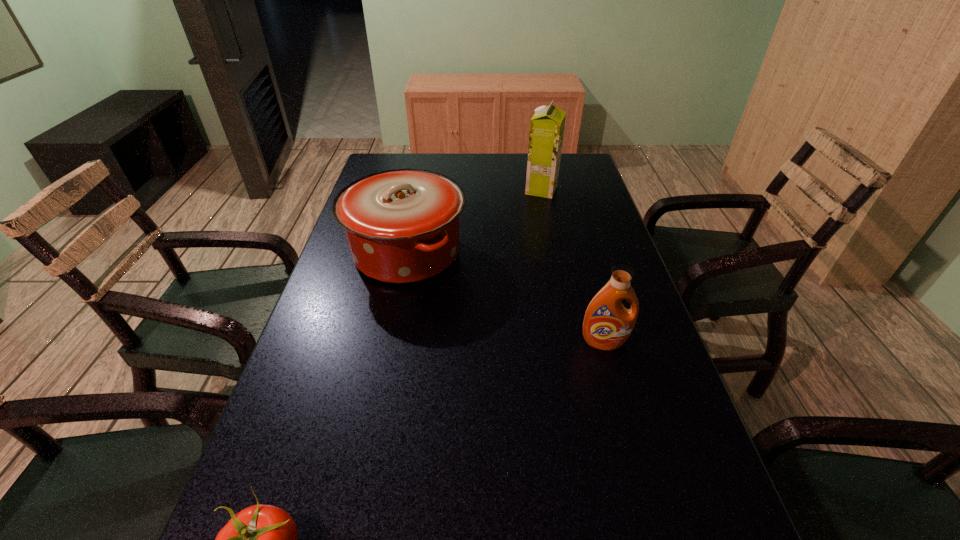
Locate an element on the screen. the tallest object is located at coordinates (547, 125).

You are a GUI agent. You are given a task and a screenshot of the screen. Output one action in this format:
    pyautogui.click(x=<x>, y=<y>)
    Task: Click on the farthest object
    
    Given the screenshot: What is the action you would take?
    pyautogui.click(x=547, y=125)

At what (x,y) coordinates should I click in order to perform the action: click on the second farthest object. Please return your answer as a coordinate pair (x, y). This screenshot has width=960, height=540. Looking at the image, I should click on (402, 226).

Identify the location of the third farthest object. This screenshot has height=540, width=960. click(x=607, y=324).

Where is `free space located on the right of the farthest object`? This screenshot has height=540, width=960. free space located on the right of the farthest object is located at coordinates (592, 190).

The width and height of the screenshot is (960, 540). Find the location of `free spot located 0.210m on the right of the casserole`. free spot located 0.210m on the right of the casserole is located at coordinates (545, 253).

Find the location of a particular element. vacant region located 0.070m on the front-facing side of the detergent is located at coordinates (613, 377).

Image resolution: width=960 pixels, height=540 pixels. What are the coordinates of `object at the far edge` in the screenshot? It's located at (547, 125).

Locate an element on the screen. The width and height of the screenshot is (960, 540). object positioned at the left edge is located at coordinates (402, 226).

Where is `soya milk that is at the right edge`? The width and height of the screenshot is (960, 540). soya milk that is at the right edge is located at coordinates (547, 125).